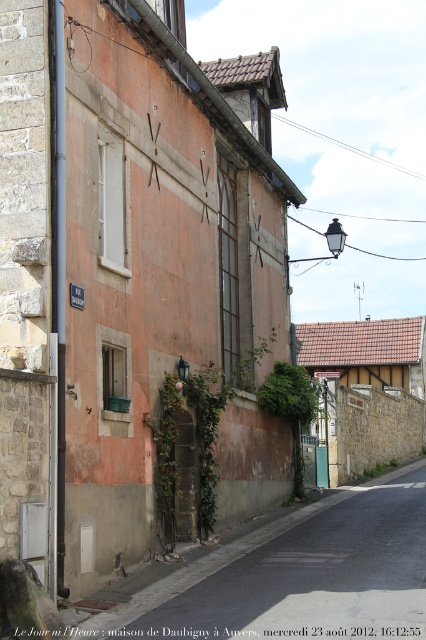
Question: Considering the relative positions of green leafy ivy at center and green plastic sign at center in the image provided, where is green leafy ivy at center located with respect to green plastic sign at center?

Choices:
 (A) above
 (B) below

Answer: (A)

Question: Which of the following is the closest to the observer?

Choices:
 (A) (294, 438)
 (B) (328, 417)

Answer: (A)

Question: Which object is farther from the camera taking this photo?

Choices:
 (A) green plastic sign at center
 (B) green leafy ivy at center

Answer: (A)

Question: Does green leafy ivy at center appear over green plastic sign at center?

Choices:
 (A) yes
 (B) no

Answer: (A)

Question: Is green leafy ivy at center positioned before green plastic sign at center?

Choices:
 (A) no
 (B) yes

Answer: (B)

Question: Among these points, which one is farthest from the camera?

Choices:
 (A) (316, 464)
 (B) (290, 390)

Answer: (A)